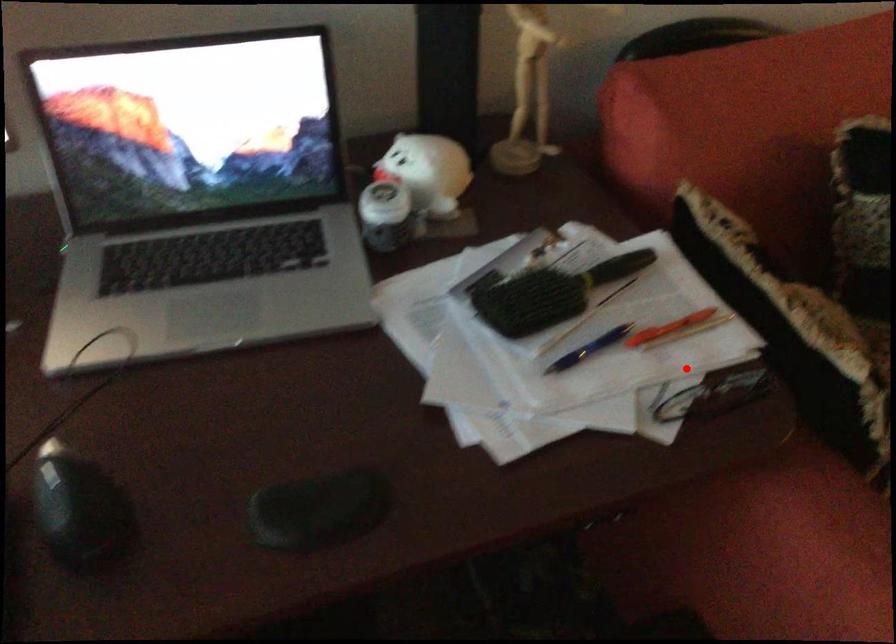
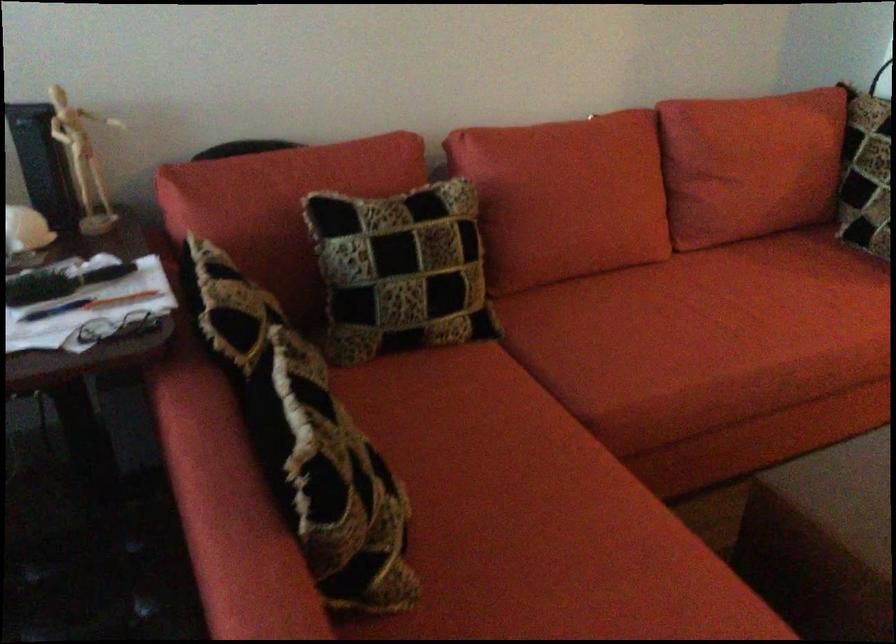
Find the pixel in the second image that matches the highlighted location in the first image.

(119, 328)